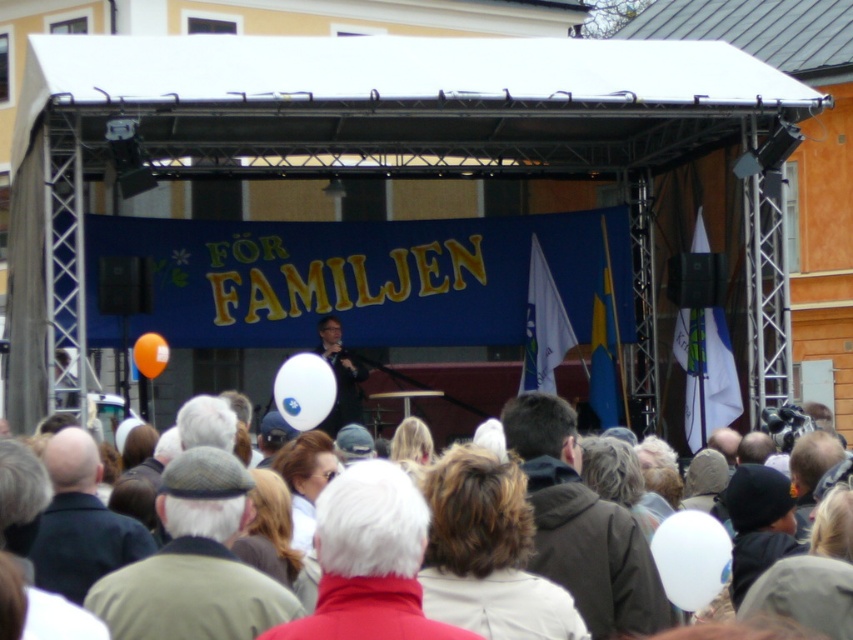
Question: Does dark brown hair at center appear under matte black microphone at center?

Choices:
 (A) yes
 (B) no

Answer: (A)

Question: Is gray woolen cap at center smaller than dark gray knit cap at lower left?

Choices:
 (A) no
 (B) yes

Answer: (A)

Question: Which point appears closest to the camera in this image?

Choices:
 (A) (279, 595)
 (B) (332, 333)

Answer: (A)

Question: Estimate the real-world distances between objects in this image. Which object is farther from the light brown hair at center?

Choices:
 (A) gray woolen cap at center
 (B) matte black microphone at center
 (C) dark brown hair at center

Answer: (B)

Question: Which point is closer to the camera?

Choices:
 (A) dark gray knit cap at lower left
 (B) matte black microphone at center
 (C) dark brown hair at center

Answer: (C)

Question: Does gray woolen cap at center appear under light brown hair at center?

Choices:
 (A) no
 (B) yes

Answer: (A)